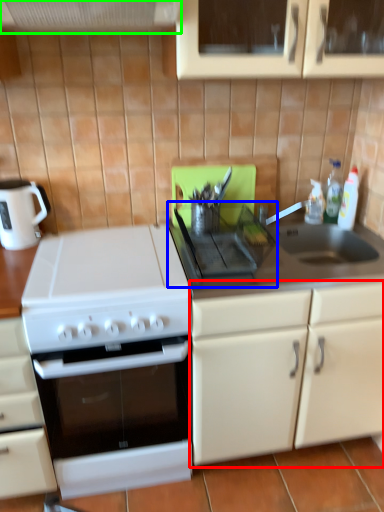
Question: Which is nearer to the cabinetry (highlighted by a red box)? gas stove (highlighted by a blue box) or exhaust hood (highlighted by a green box).

Choices:
 (A) gas stove
 (B) exhaust hood

Answer: (A)